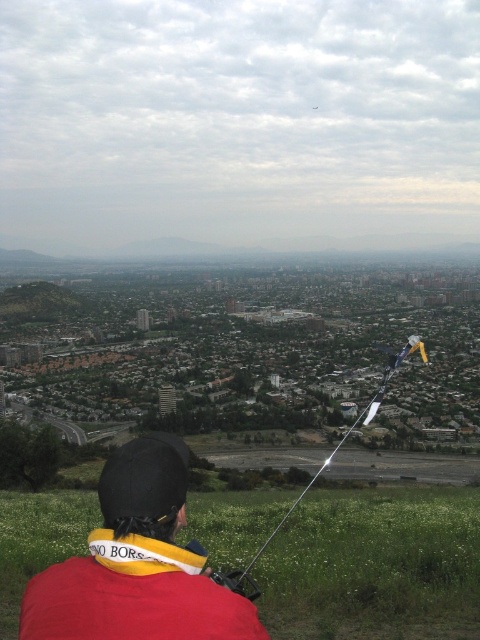
Question: Estimate the real-world distances between objects in this image. Which object is closer to the metallic silver string at lower center?

Choices:
 (A) green grassy field at lower center
 (B) red fabric jacket at lower center

Answer: (A)

Question: Where is green grassy field at lower center located in relation to metallic silver string at lower center in the image?

Choices:
 (A) right
 (B) left

Answer: (B)

Question: Does green grassy field at lower center have a greater width compared to metallic silver string at lower center?

Choices:
 (A) yes
 (B) no

Answer: (A)

Question: Which object appears closest to the camera in this image?

Choices:
 (A) metallic silver string at lower center
 (B) green grassy field at lower center
 (C) red fabric jacket at lower center

Answer: (C)

Question: Does green grassy field at lower center appear over metallic silver string at lower center?

Choices:
 (A) no
 (B) yes

Answer: (A)

Question: Which object appears closest to the camera in this image?

Choices:
 (A) metallic silver string at lower center
 (B) red fabric jacket at lower center
 (C) green grassy field at lower center

Answer: (B)